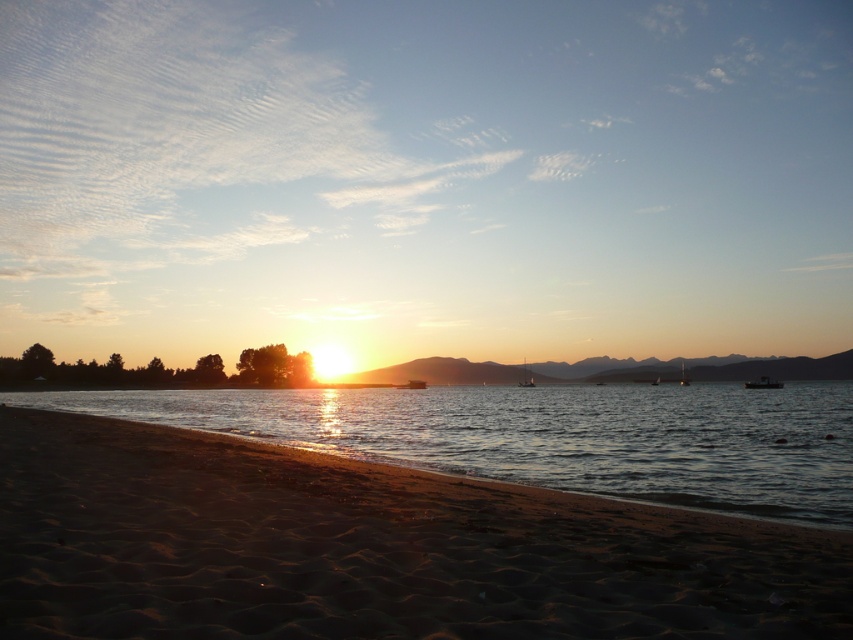
The image size is (853, 640). In order to click on sandy beach at lower left in this screenshot , I will do (x=369, y=548).

Can you confirm if sandy beach at lower left is positioned below glistening water at center?

No, sandy beach at lower left is not below glistening water at center.

You are a GUI agent. You are given a task and a screenshot of the screen. Output one action in this format:
    pyautogui.click(x=<x>, y=<y>)
    Task: Click on the sandy beach at lower left
    The height and width of the screenshot is (640, 853).
    Given the screenshot: What is the action you would take?
    pyautogui.click(x=369, y=548)

Where is `sandy beach at lower left`? The width and height of the screenshot is (853, 640). sandy beach at lower left is located at coordinates (369, 548).